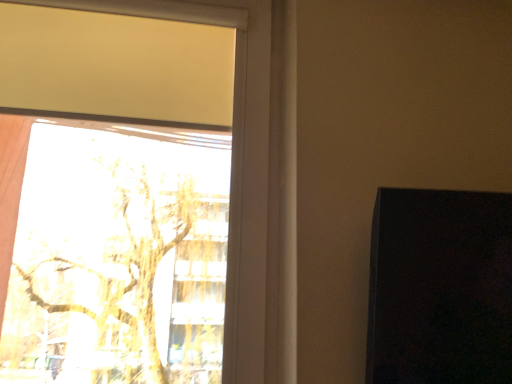
Find the location of a particular element. transparent glass window at upper left is located at coordinates pos(231,165).

What do you see at coordinates (231, 165) in the screenshot? This screenshot has height=384, width=512. I see `transparent glass window at upper left` at bounding box center [231, 165].

This screenshot has width=512, height=384. Identify the location of transparent glass window at upper left. (231, 165).